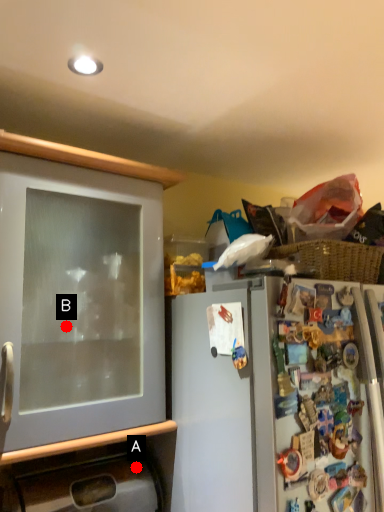
Question: Two points are circled on the image, labeled by A and B beside each circle. Among these points, which one is nearest to the camera?

Choices:
 (A) A is closer
 (B) B is closer

Answer: (B)